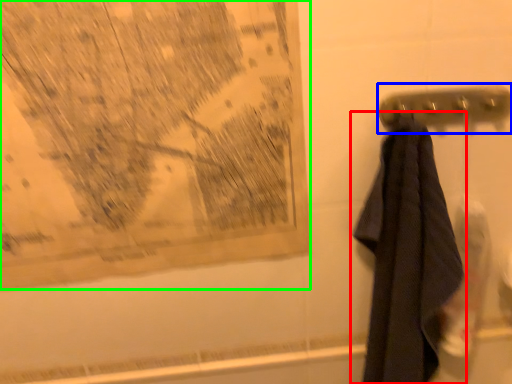
Question: Which object is positioned closest to towel (highlighted by a red box)? Select from towel bar (highlighted by a blue box) and map (highlighted by a green box).

Choices:
 (A) towel bar
 (B) map

Answer: (A)